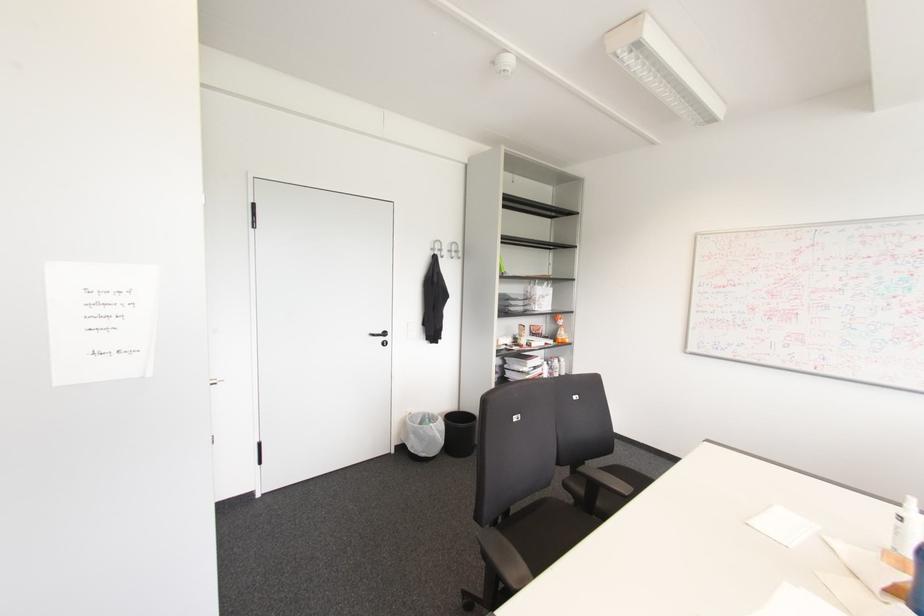
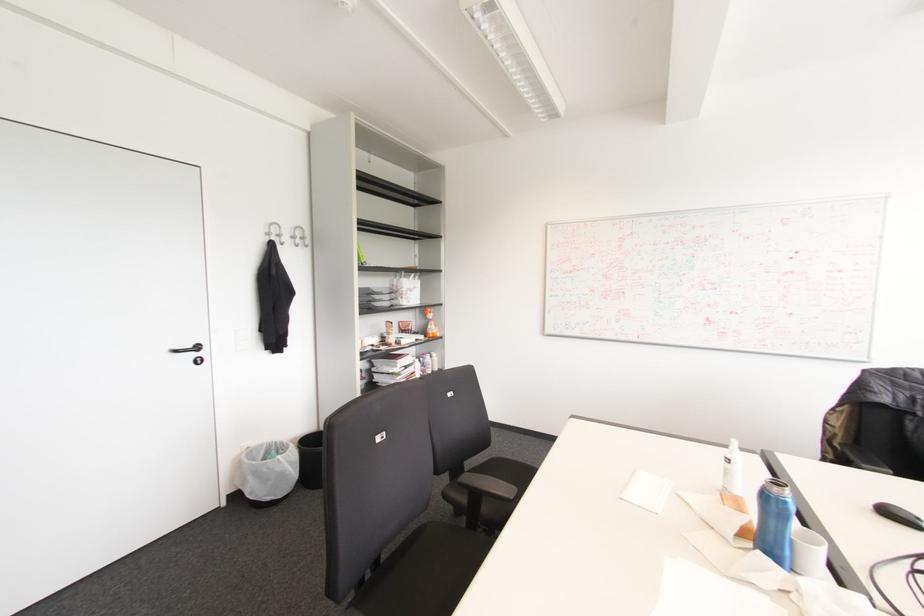
The point at (410, 436) is marked in the first image. Where is the corresponding point in the second image?

(249, 477)